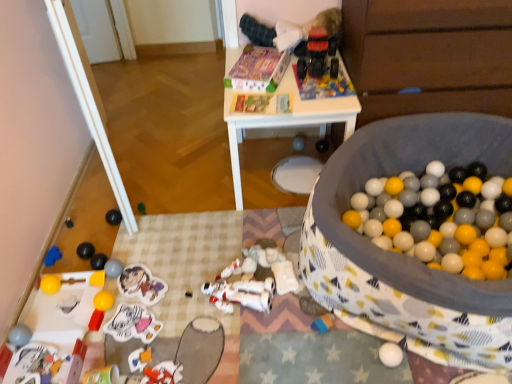
Where is `free space in front of white matte robot at center, marked as the fifteenth toy in a left-to-right arrangement`? This screenshot has height=384, width=512. free space in front of white matte robot at center, marked as the fifteenth toy in a left-to-right arrangement is located at coordinates (238, 346).